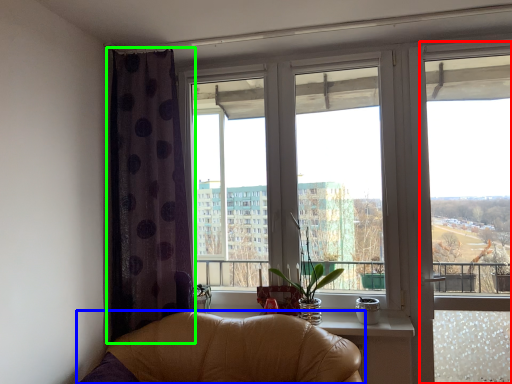
Question: Considering the real-world distances, which object is farthest from window frame (highlighted by a red box)? chair (highlighted by a blue box) or curtain (highlighted by a green box)?

Choices:
 (A) chair
 (B) curtain

Answer: (B)